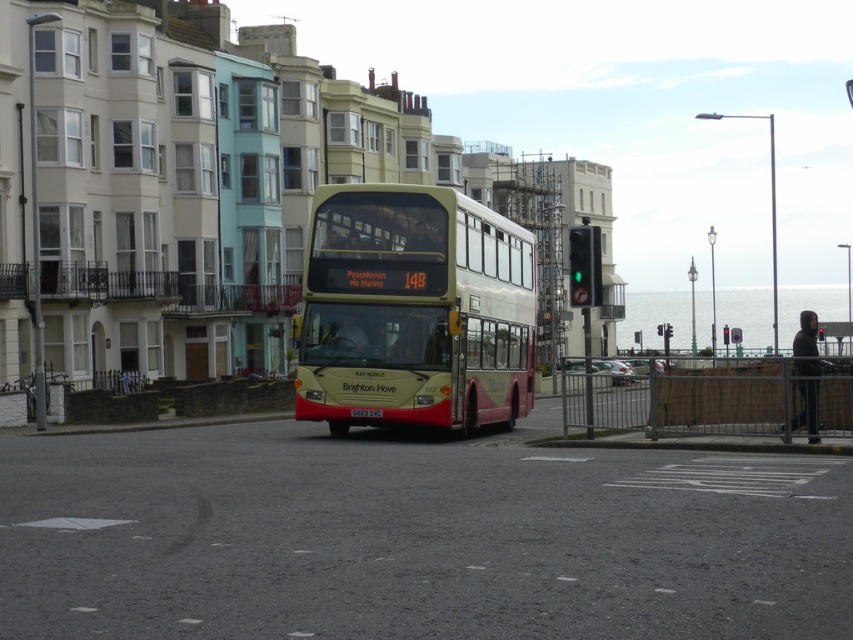
From the picture: You are a delivery driver who needs to park your truck at the point marked by coordinates (415, 310). The truck requires a minimum space of 10 meters in length. Can you determine if the space at that point is suitable for parking?

The beige glossy decker bus at center is represented by point (415, 310). Since the bus itself is parked there, the space is occupied and cannot accommodate the truck.

You are a delivery driver who needs to pass under the green glass traffic light at center with your beige glossy decker bus at center. Can you safely drive through without hitting the light?

The beige glossy decker bus at center has a lesser height compared to green glass traffic light at center, so it can safely pass under the light without any issues.

You are a pedestrian waiting to cross the street. The traffic light you are looking at is the green glass traffic light at center. Is the traffic light in front of or behind the beige glossy decker bus at center?

The green glass traffic light at center is behind the beige glossy decker bus at center, so it is not in front of the bus.